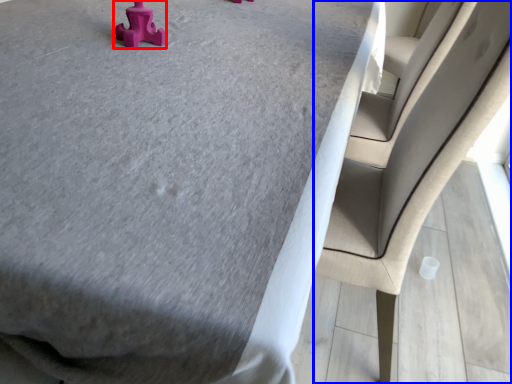
Question: Which of the following is the closest to the observer, toy (highlighted by a red box) or chair (highlighted by a blue box)?

Choices:
 (A) toy
 (B) chair

Answer: (B)